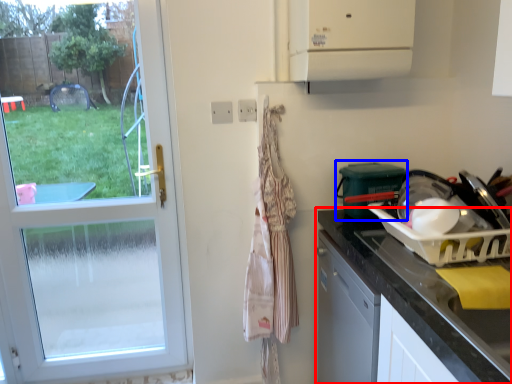
Question: Which of the following is the farthest to the observer, countertop (highlighted by a red box) or appliance (highlighted by a blue box)?

Choices:
 (A) countertop
 (B) appliance

Answer: (B)